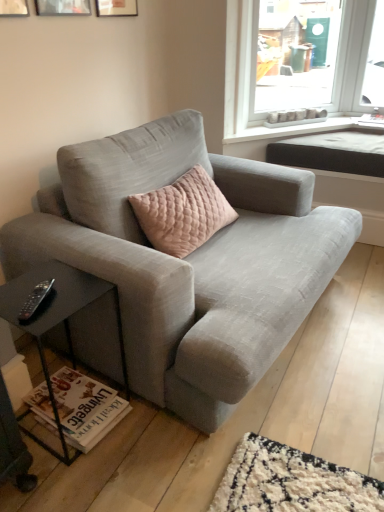
Identify the location of free space above black matte side table at lower left (from a real-world perspective). (53, 295).